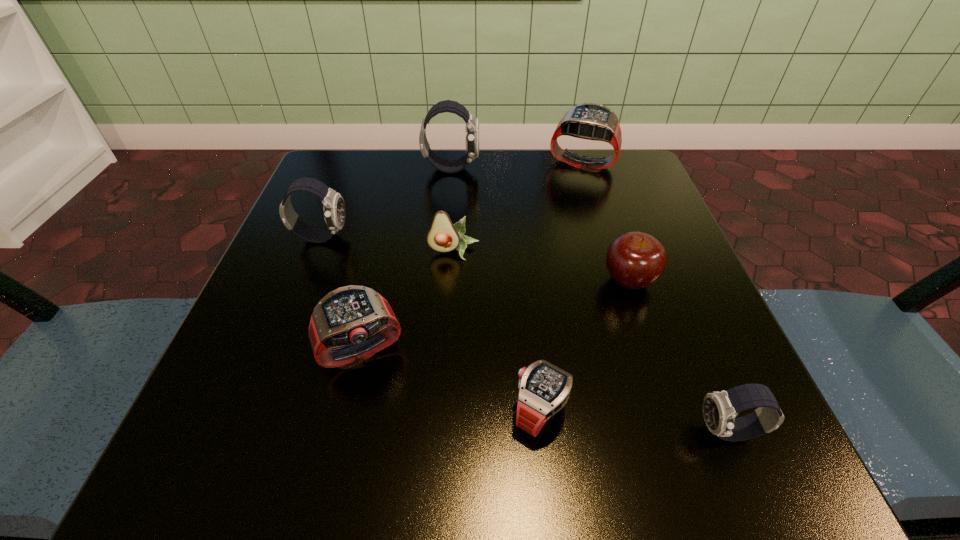
Image resolution: width=960 pixels, height=540 pixels. What are the coordinates of `red watch that is the nearest to the second smallest dark watch` in the screenshot? It's located at (350, 324).

Identify the location of red watch that is the second closest to the farthest red watch. The image size is (960, 540). (544, 389).

Identify the location of vacant area in the image that satisfies the following two spatial constraints: 1. on the back side of the third watch from right to left; 2. on the right side of the rightmost red watch. The image size is (960, 540). (515, 163).

Locate an element on the screen. Image resolution: width=960 pixels, height=540 pixels. blank space that satisfies the following two spatial constraints: 1. on the seed side of the red apple; 2. on the right side of the avocado is located at coordinates (452, 280).

You are a GUI agent. You are given a task and a screenshot of the screen. Output one action in this format:
    pyautogui.click(x=<x>, y=<y>)
    Task: Click on the vacant point that satisfies the following two spatial constraints: 1. on the face of the tallest watch; 2. on the front side of the fourth farthest watch
    This screenshot has width=960, height=540.
    Given the screenshot: What is the action you would take?
    pyautogui.click(x=436, y=352)

The height and width of the screenshot is (540, 960). Identify the location of blank space that satisfies the following two spatial constraints: 1. on the face of the red apple; 2. on the right side of the second nearest dark watch. (304, 280).

At what (x,y) coordinates should I click in order to perform the action: click on free location that satisfies the following two spatial constraints: 1. on the face of the red apple; 2. on the left side of the farthest dark watch. Please return your answer as a coordinate pair (x, y). This screenshot has width=960, height=540. Looking at the image, I should click on coord(442,280).